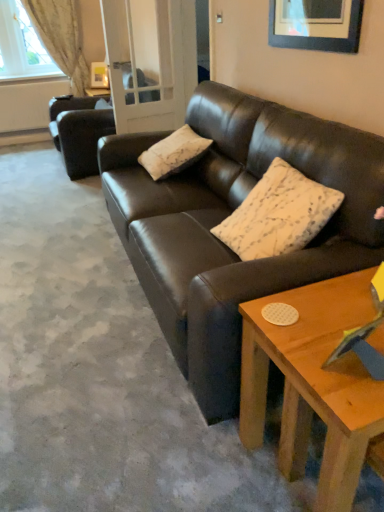
Question: Can you confirm if wooden coffee table at lower right is bigger than shiny brown leather couch at center, marked as the 2th studio couch in a back-to-front arrangement?

Choices:
 (A) yes
 (B) no

Answer: (B)

Question: Could you tell me if wooden coffee table at lower right is turned towards shiny brown leather couch at center, which is counted as the 1th studio couch, starting from the right?

Choices:
 (A) no
 (B) yes

Answer: (A)

Question: Is wooden coffee table at lower right to the right of shiny brown leather couch at center, marked as the 2th studio couch in a back-to-front arrangement, from the viewer's perspective?

Choices:
 (A) yes
 (B) no

Answer: (A)

Question: Is shiny brown leather couch at center, the 2th studio couch from the left, a part of wooden coffee table at lower right?

Choices:
 (A) no
 (B) yes

Answer: (A)

Question: Is wooden coffee table at lower right directly adjacent to shiny brown leather couch at center, which is counted as the 1th studio couch, starting from the right?

Choices:
 (A) yes
 (B) no

Answer: (B)

Question: Considering the relative sizes of wooden coffee table at lower right and shiny brown leather couch at center, acting as the 1th studio couch starting from the front, in the image provided, is wooden coffee table at lower right shorter than shiny brown leather couch at center, acting as the 1th studio couch starting from the front,?

Choices:
 (A) no
 (B) yes

Answer: (B)

Question: Considering the relative sizes of white textured pillow at center, acting as the 2th pillow starting from the left, and white textured curtain at upper left in the image provided, is white textured pillow at center, acting as the 2th pillow starting from the left, wider than white textured curtain at upper left?

Choices:
 (A) yes
 (B) no

Answer: (A)

Question: Does white textured pillow at center, placed as the second pillow when sorted from top to bottom, appear on the left side of white textured curtain at upper left?

Choices:
 (A) yes
 (B) no

Answer: (B)

Question: Is white textured pillow at center, placed as the second pillow when sorted from top to bottom, facing towards white textured curtain at upper left?

Choices:
 (A) no
 (B) yes

Answer: (A)

Question: Would you say white textured pillow at center, which appears as the first pillow when ordered from the bottom, contains white textured curtain at upper left?

Choices:
 (A) yes
 (B) no

Answer: (B)

Question: Can you confirm if white textured pillow at center, placed as the second pillow when sorted from top to bottom, is taller than white textured curtain at upper left?

Choices:
 (A) yes
 (B) no

Answer: (B)

Question: Considering the relative sizes of white textured pillow at center, which appears as the first pillow when ordered from the bottom, and white textured curtain at upper left in the image provided, is white textured pillow at center, which appears as the first pillow when ordered from the bottom, thinner than white textured curtain at upper left?

Choices:
 (A) no
 (B) yes

Answer: (A)

Question: Is white textured pillow at center, placed as the second pillow when sorted from right to left, at the left side of clear glass door at center?

Choices:
 (A) yes
 (B) no

Answer: (B)